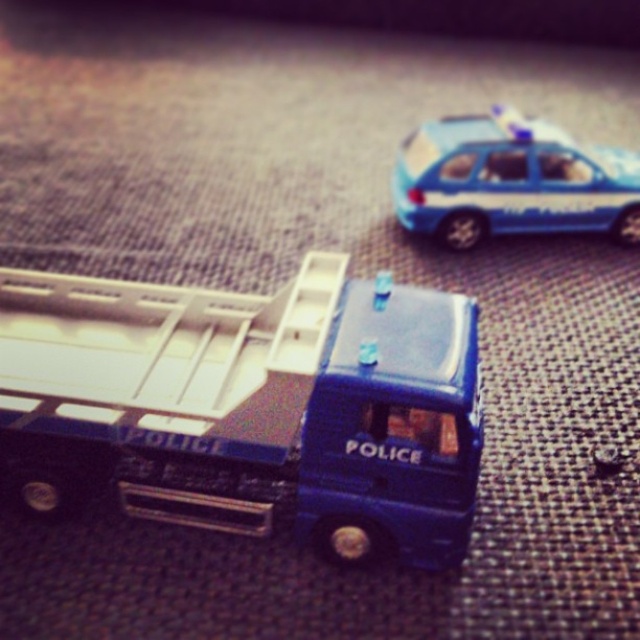
Question: Can you confirm if blue metallic truck at center is bigger than blue plastic car at upper right?

Choices:
 (A) yes
 (B) no

Answer: (A)

Question: Which point appears farthest from the camera in this image?

Choices:
 (A) (116, 326)
 (B) (525, 230)

Answer: (B)

Question: Is blue metallic truck at center above blue plastic car at upper right?

Choices:
 (A) no
 (B) yes

Answer: (A)

Question: Which point is farther to the camera?

Choices:
 (A) (628, 225)
 (B) (332, 480)

Answer: (A)

Question: Can you confirm if blue metallic truck at center is bigger than blue plastic car at upper right?

Choices:
 (A) yes
 (B) no

Answer: (A)